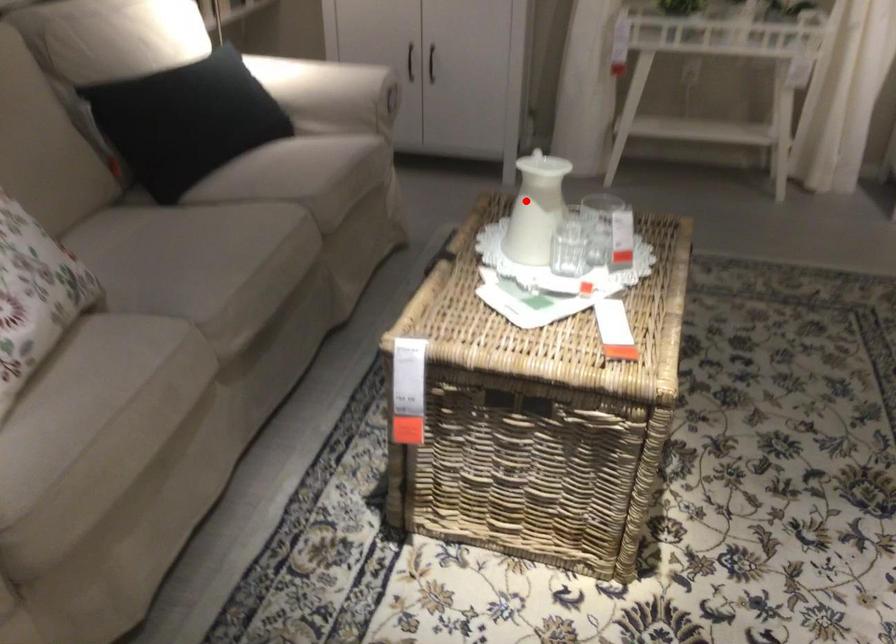
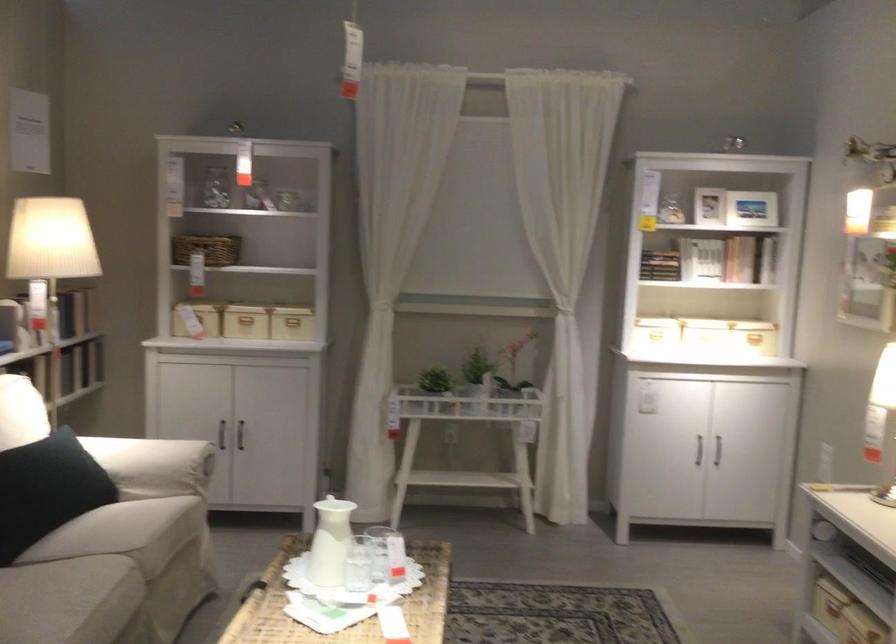
Question: I am providing you with two images of the same scene from different viewpoints. Image1 has a red point marked. In image2, the corresponding 3D location appears at what relative position? Reply with the corresponding letter.

Choices:
 (A) Closer
 (B) Farther

Answer: (B)